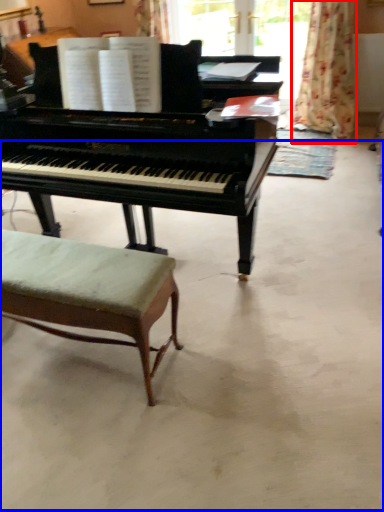
Question: Among these objects, which one is farthest to the camera, curtain (highlighted by a red box) or concrete (highlighted by a blue box)?

Choices:
 (A) curtain
 (B) concrete

Answer: (A)